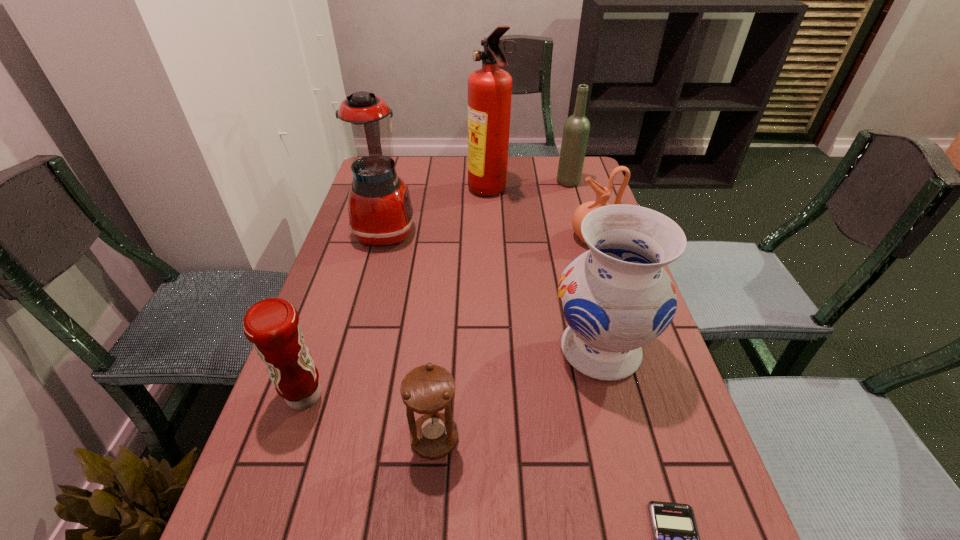
The image size is (960, 540). Find the location of `free location located 0.330m on the controls of the food processor`. free location located 0.330m on the controls of the food processor is located at coordinates (525, 231).

Find the location of a particular element. vacant area situated on the front of the wine bottle is located at coordinates (578, 214).

At what (x,y) coordinates should I click in order to perform the action: click on free spot located 0.100m on the back of the vase. Please return your answer as a coordinate pair (x, y). This screenshot has width=960, height=540. Looking at the image, I should click on (584, 285).

Find the location of a particular element. free spot located 0.200m on the front of the condiment is located at coordinates [257, 534].

You are a GUI agent. You are given a task and a screenshot of the screen. Output one action in this format:
    pyautogui.click(x=<x>, y=<y>)
    Task: Click on the free space located 0.220m on the spout of the pottery
    This screenshot has height=540, width=960.
    Given the screenshot: What is the action you would take?
    pyautogui.click(x=495, y=238)

This screenshot has width=960, height=540. Identify the location of vacant position located 0.400m on the spout of the pottery. (435, 238).

Identify the location of free region located 0.370m on the spout of the pottery. (445, 238).

You are a GUI agent. You are given a task and a screenshot of the screen. Output one action in this format:
    pyautogui.click(x=<x>, y=<y>)
    Task: Click on the vacant area situated on the front of the hourglass
    Image resolution: width=960 pixels, height=540 pixels.
    Given the screenshot: What is the action you would take?
    pyautogui.click(x=429, y=508)

I want to click on fire extinguisher that is at the far edge, so click(489, 88).

You are a GUI agent. You are given a task and a screenshot of the screen. Output one action in this format:
    pyautogui.click(x=<x>, y=<y>)
    Task: Click on the wine bottle that is at the far edge
    The height and width of the screenshot is (540, 960).
    Given the screenshot: What is the action you would take?
    pyautogui.click(x=576, y=130)